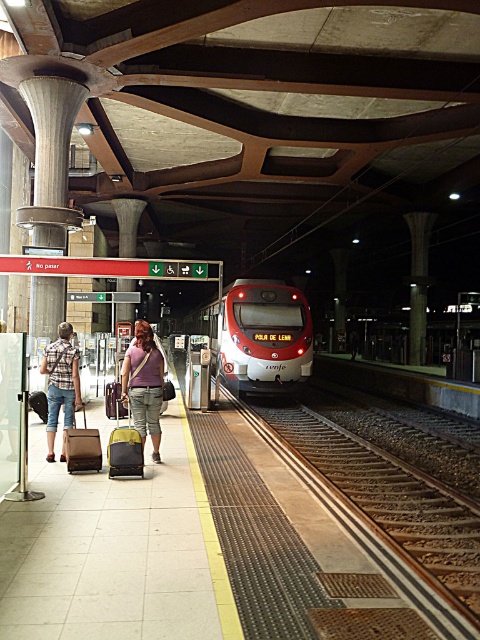
You are on the train station platform at night. There are two points marked on the platform floor. The first point is at coordinate point (446,561) and the second point is at coordinate point (111,410). If you are facing the direction of the train tracks, which point is closer to you?

Point (446,561) is in front of point (111,410), so if you are facing the train tracks, point (446,561) is closer to you.